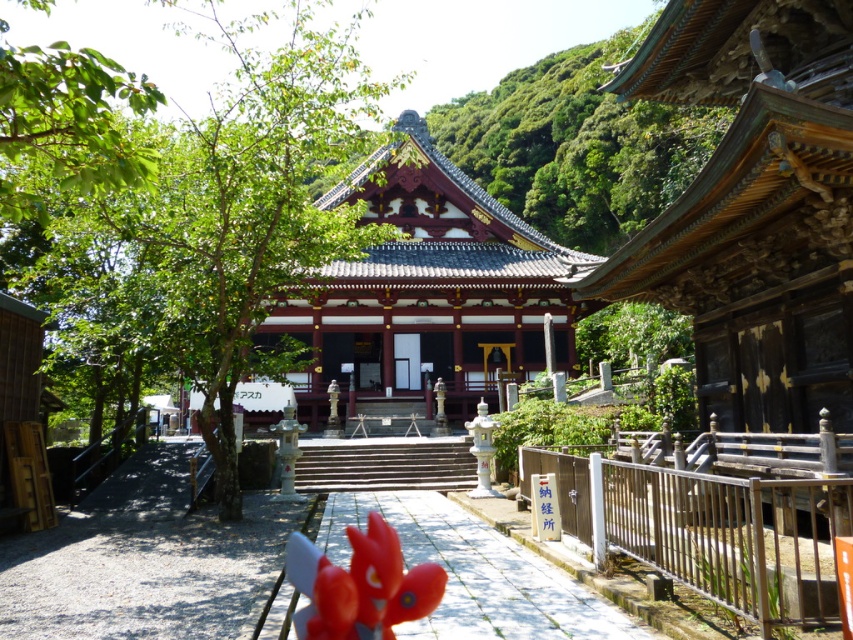
Which is more to the left, green leafy tree at center or shiny red wood pagoda at center?

Positioned to the left is green leafy tree at center.

Does green leafy tree at center appear on the left side of shiny red wood pagoda at center?

Yes, green leafy tree at center is to the left of shiny red wood pagoda at center.

Where is `green leafy tree at center`? The image size is (853, 640). green leafy tree at center is located at coordinates (192, 205).

Does shiny red wood pagoda at center have a greater width compared to green leafy tree at upper center?

No, shiny red wood pagoda at center is not wider than green leafy tree at upper center.

Is point (374, 260) closer to camera compared to point (718, 124)?

Yes, it is.

What are the coordinates of `shiny red wood pagoda at center` in the screenshot? It's located at (428, 291).

Based on the photo, is green leafy tree at center to the right of green leafy tree at upper center from the viewer's perspective?

No, green leafy tree at center is not to the right of green leafy tree at upper center.

Is green leafy tree at center thinner than green leafy tree at upper center?

Incorrect, green leafy tree at center's width is not less than green leafy tree at upper center's.

Describe the element at coordinates (192, 205) in the screenshot. The height and width of the screenshot is (640, 853). I see `green leafy tree at center` at that location.

You are a GUI agent. You are given a task and a screenshot of the screen. Output one action in this format:
    pyautogui.click(x=<x>, y=<y>)
    Task: Click on the green leafy tree at center
    This screenshot has width=853, height=640.
    Given the screenshot: What is the action you would take?
    pyautogui.click(x=192, y=205)